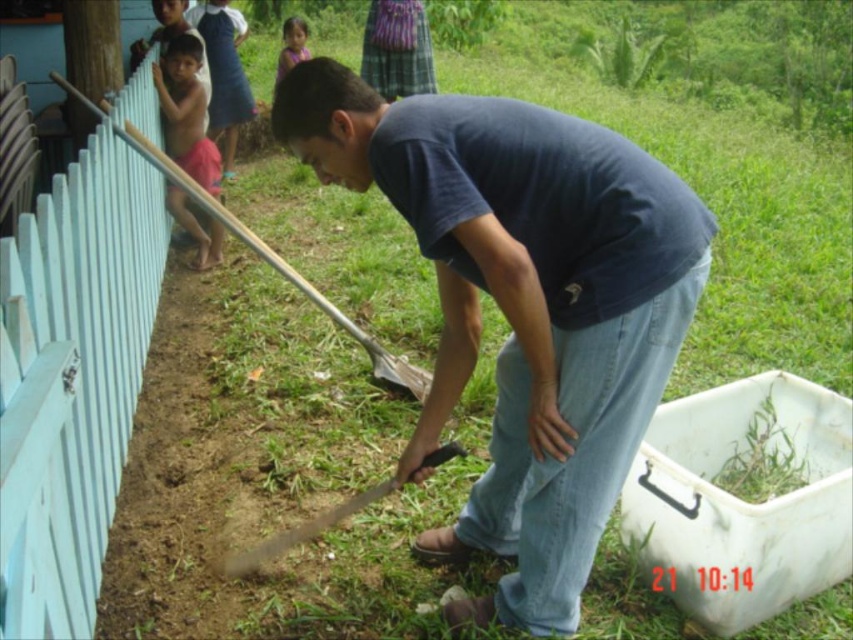
Does point (608, 330) lie in front of point (16, 321)?

No, it is not.

Where is `dark blue t-shirt at center`? dark blue t-shirt at center is located at coordinates click(x=523, y=305).

Who is positioned more to the right, shiny pink shorts at left or metallic silver shovel at lower center?

metallic silver shovel at lower center is more to the right.

Is point (167, 45) more distant than point (457, 448)?

Yes.

You are a GUI agent. You are given a task and a screenshot of the screen. Output one action in this format:
    pyautogui.click(x=<x>, y=<y>)
    Task: Click on the shiny pink shorts at left
    This screenshot has width=853, height=640.
    Given the screenshot: What is the action you would take?
    pyautogui.click(x=186, y=112)

Does point (102, 305) lie in front of point (317, 520)?

Yes, point (102, 305) is closer to viewer.

Is light blue wooden fence at left in front of metallic silver shovel at lower center?

Yes, it is.

The height and width of the screenshot is (640, 853). What are the coordinates of `light blue wooden fence at left` in the screenshot? It's located at (73, 378).

Find the location of a particular element. This screenshot has width=853, height=640. light blue wooden fence at left is located at coordinates (73, 378).